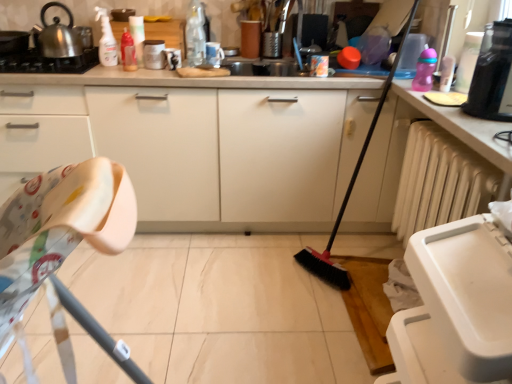
What do you see at coordinates (440, 181) in the screenshot?
I see `white plastic radiator at lower right` at bounding box center [440, 181].

Measure the distance between white glossy spray bottle at upper center and camera.

The distance of white glossy spray bottle at upper center from camera is 6.87 feet.

Locate an element on the screen. The image size is (512, 384). white glossy spray bottle at upper center is located at coordinates (106, 39).

The height and width of the screenshot is (384, 512). Describe the element at coordinates (13, 42) in the screenshot. I see `metallic stainless steel kettle at upper left, marked as the 3th appliance in a bottom-to-top arrangement` at that location.

How much space does metallic stainless steel kettle at upper left, the 3th appliance viewed from the right, occupy vertically?

10.05 centimeters.

The image size is (512, 384). In order to click on shiny metallic kettle at upper left in this screenshot , I will do `click(60, 36)`.

Identify the location of white plastic trash can at lower right, positioned as the first appliance in bottom-to-top order. Image resolution: width=512 pixels, height=384 pixels. (456, 307).

The image size is (512, 384). In order to click on transparent glass bottle at upper center, arranged as the third bottle when viewed from the left in this screenshot , I will do `click(195, 34)`.

Locate an element on the screen. metallic stainless steel kettle at upper left is located at coordinates (48, 62).

From the picture: Considering the sizes of white plastic folding chair at left and purple plastic sippy cup at upper right in the image, is white plastic folding chair at left taller or shorter than purple plastic sippy cup at upper right?

Clearly, white plastic folding chair at left is taller compared to purple plastic sippy cup at upper right.

Does white plastic folding chair at left have a larger size compared to purple plastic sippy cup at upper right?

Yes, white plastic folding chair at left is bigger than purple plastic sippy cup at upper right.

Is purple plastic sippy cup at upper right completely or partially inside white plastic folding chair at left?

No, purple plastic sippy cup at upper right is not a part of white plastic folding chair at left.

Is white plastic radiator at lower right closer to the viewer compared to purple plastic sippy cup at upper right?

Yes, it is.

Is white plastic radiator at lower right bigger or smaller than purple plastic sippy cup at upper right?

In the image, white plastic radiator at lower right appears to be larger than purple plastic sippy cup at upper right.

Is purple plastic sippy cup at upper right at the back of white plastic radiator at lower right?

No.

Is matte white mug at upper center, the second appliance positioned from the right, spatially inside purple plastic sippy cup at upper right, or outside of it?

matte white mug at upper center, the second appliance positioned from the right, is not inside purple plastic sippy cup at upper right, it's outside.

Considering the relative positions of matte white mug at upper center, which is the second appliance in left-to-right order, and purple plastic sippy cup at upper right in the image provided, is matte white mug at upper center, which is the second appliance in left-to-right order, to the left of purple plastic sippy cup at upper right from the viewer's perspective?

Yes.

Is point (151, 47) closer to viewer compared to point (429, 58)?

No.

Where is `the 1st appliance located beneath the purple plastic sippy cup at upper right (from a real-world perspective)`? This screenshot has width=512, height=384. the 1st appliance located beneath the purple plastic sippy cup at upper right (from a real-world perspective) is located at coordinates (154, 54).

Is transparent glass bottle at upper center, arranged as the third bottle when viewed from the left, inside matte white mug at upper center, the second appliance positioned from the right?

No, transparent glass bottle at upper center, arranged as the third bottle when viewed from the left, is not inside matte white mug at upper center, the second appliance positioned from the right.

Consider the image. Considering the positions of objects matte white mug at upper center, the third appliance in the front-to-back sequence, and transparent glass bottle at upper center, arranged as the third bottle when viewed from the left, in the image provided, who is behind, matte white mug at upper center, the third appliance in the front-to-back sequence, or transparent glass bottle at upper center, arranged as the third bottle when viewed from the left,?

matte white mug at upper center, the third appliance in the front-to-back sequence, is more distant.

Considering the relative sizes of matte white mug at upper center, which is the second appliance in left-to-right order, and transparent glass bottle at upper center, arranged as the third bottle when viewed from the left, in the image provided, is matte white mug at upper center, which is the second appliance in left-to-right order, thinner than transparent glass bottle at upper center, arranged as the third bottle when viewed from the left,?

In fact, matte white mug at upper center, which is the second appliance in left-to-right order, might be wider than transparent glass bottle at upper center, arranged as the third bottle when viewed from the left.

Considering the relative sizes of translucent plastic spray bottle at upper center, acting as the 2th bottle starting from the right, and translucent plastic bottle at upper center, which is counted as the 1th bottle, starting from the left, in the image provided, is translucent plastic spray bottle at upper center, acting as the 2th bottle starting from the right, thinner than translucent plastic bottle at upper center, which is counted as the 1th bottle, starting from the left,?

Indeed, translucent plastic spray bottle at upper center, acting as the 2th bottle starting from the right, has a lesser width compared to translucent plastic bottle at upper center, which is counted as the 1th bottle, starting from the left.

Would you say translucent plastic spray bottle at upper center, acting as the 2th bottle starting from the right, is a long distance from translucent plastic bottle at upper center, which is counted as the 3th bottle, starting from the right?

Actually, translucent plastic spray bottle at upper center, acting as the 2th bottle starting from the right, and translucent plastic bottle at upper center, which is counted as the 3th bottle, starting from the right, are a little close together.

Is translucent plastic spray bottle at upper center, acting as the 2th bottle starting from the right, not within translucent plastic bottle at upper center, which is counted as the 3th bottle, starting from the right?

That's correct, translucent plastic spray bottle at upper center, acting as the 2th bottle starting from the right, is outside of translucent plastic bottle at upper center, which is counted as the 3th bottle, starting from the right.

From the picture: Is translucent plastic spray bottle at upper center, acting as the 2th bottle starting from the right, facing towards translucent plastic bottle at upper center, which is counted as the 3th bottle, starting from the right?

Yes, translucent plastic spray bottle at upper center, acting as the 2th bottle starting from the right, is aimed at translucent plastic bottle at upper center, which is counted as the 3th bottle, starting from the right.

Can you tell me how much white plastic folding chair at left and metallic stainless steel kettle at upper left differ in facing direction?

89.9 degrees.

Considering the positions of objects white plastic folding chair at left and metallic stainless steel kettle at upper left in the image provided, who is more to the right, white plastic folding chair at left or metallic stainless steel kettle at upper left?

white plastic folding chair at left.

Is white plastic folding chair at left bigger than metallic stainless steel kettle at upper left?

Indeed, white plastic folding chair at left has a larger size compared to metallic stainless steel kettle at upper left.

Is white plastic folding chair at left oriented towards metallic stainless steel kettle at upper left?

No, white plastic folding chair at left is not oriented towards metallic stainless steel kettle at upper left.

Considering the points (141, 46) and (452, 350), which point is behind, point (141, 46) or point (452, 350)?

The point (141, 46) is farther.

Can you tell me how much translucent plastic spray bottle at upper center, which appears as the second bottle when viewed from the left, and white plastic trash can at lower right, the 3th appliance positioned from the back, differ in facing direction?

The facing directions of translucent plastic spray bottle at upper center, which appears as the second bottle when viewed from the left, and white plastic trash can at lower right, the 3th appliance positioned from the back, are 90.3 degrees apart.

Who is shorter, translucent plastic spray bottle at upper center, acting as the 2th bottle starting from the right, or white plastic trash can at lower right, placed as the third appliance when sorted from top to bottom?

With less height is translucent plastic spray bottle at upper center, acting as the 2th bottle starting from the right.

Can you confirm if translucent plastic spray bottle at upper center, acting as the 2th bottle starting from the right, is smaller than white plastic trash can at lower right, placed as the first appliance when sorted from right to left?

Yes.

The height and width of the screenshot is (384, 512). In order to click on folding chair below the purple plastic sippy cup at upper right (from the image's perspective) in this screenshot , I will do `click(64, 238)`.

Image resolution: width=512 pixels, height=384 pixels. Identify the location of radiator beneath the purple plastic sippy cup at upper right (from a real-world perspective). (440, 181).

Based on the photo, looking at the image, which one is located closer to white plastic folding chair at left, metallic stainless steel kettle at upper left, which appears as the second appliance when viewed from the back, or purple plastic sippy cup at upper right?

Based on the image, purple plastic sippy cup at upper right appears to be nearer to white plastic folding chair at left.

Which object lies further to the anchor point translucent plastic spray bottle at upper center, acting as the 2th bottle starting from the right, metallic stainless steel kettle at upper left, which is the first appliance from top to bottom, or purple plastic sippy cup at upper right?

Based on the image, purple plastic sippy cup at upper right appears to be further to translucent plastic spray bottle at upper center, acting as the 2th bottle starting from the right.

Which object lies further to the anchor point translucent plastic spray bottle at upper center, which appears as the second bottle when viewed from the left, purple plastic sippy cup at upper right or metallic stainless steel kettle at upper left, marked as the 3th appliance in a bottom-to-top arrangement?

purple plastic sippy cup at upper right.

Considering their positions, is matte white mug at upper center, the second appliance positioned from the right, positioned further to purple plastic sippy cup at upper right than black plastic coffee maker at upper right?

matte white mug at upper center, the second appliance positioned from the right.

Looking at the image, which one is located closer to transparent glass bottle at upper center, which is the first bottle from right to left, purple plastic sippy cup at upper right or white glossy spray bottle at upper center?

The object closer to transparent glass bottle at upper center, which is the first bottle from right to left, is white glossy spray bottle at upper center.

Looking at the image, which one is located further to white plastic trash can at lower right, the 3th appliance positioned from the back, matte white mug at upper center, acting as the 1th appliance starting from the back, or shiny metallic kettle at upper left?

shiny metallic kettle at upper left is further to white plastic trash can at lower right, the 3th appliance positioned from the back.

When comparing their distances from metallic stainless steel kettle at upper left, does black plastic coffee maker at upper right or metallic stainless steel kettle at upper left, marked as the 3th appliance in a bottom-to-top arrangement, seem further?

black plastic coffee maker at upper right is further to metallic stainless steel kettle at upper left.

Estimate the real-world distances between objects in this image. Which object is closer to white glossy spray bottle at upper center, white plastic folding chair at left or white plastic radiator at lower right?

Based on the image, white plastic radiator at lower right appears to be nearer to white glossy spray bottle at upper center.

The width and height of the screenshot is (512, 384). In order to click on toy between white plastic folding chair at left and translucent plastic bottle at upper center, which is counted as the 1th bottle, starting from the left, in the front-back direction in this screenshot , I will do `click(424, 70)`.

The width and height of the screenshot is (512, 384). What are the coordinates of `cleaning product between metallic stainless steel kettle at upper left, marked as the 1th appliance in a left-to-right arrangement, and purple plastic sippy cup at upper right, in the horizontal direction` in the screenshot? It's located at (106, 39).

Identify the location of home appliance located between metallic stainless steel kettle at upper left, which appears as the second appliance when viewed from the back, and white plastic trash can at lower right, positioned as the first appliance in bottom-to-top order, in the left-right direction. Image resolution: width=512 pixels, height=384 pixels. (48, 62).

The image size is (512, 384). I want to click on cleaning product between metallic stainless steel kettle at upper left and translucent plastic spray bottle at upper center, acting as the 2th bottle starting from the right, in the horizontal direction, so click(106, 39).